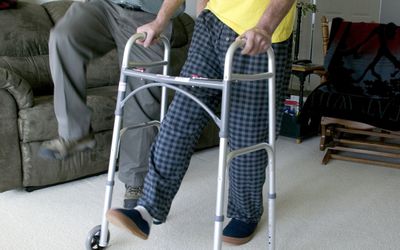
Find the location of a particular element. This screenshot has width=400, height=250. carpet is located at coordinates (329, 186).